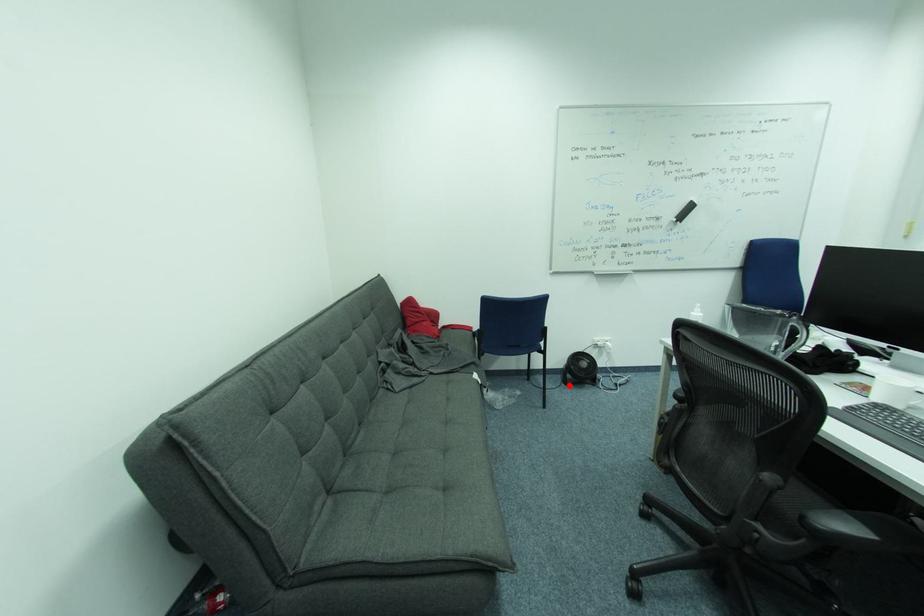
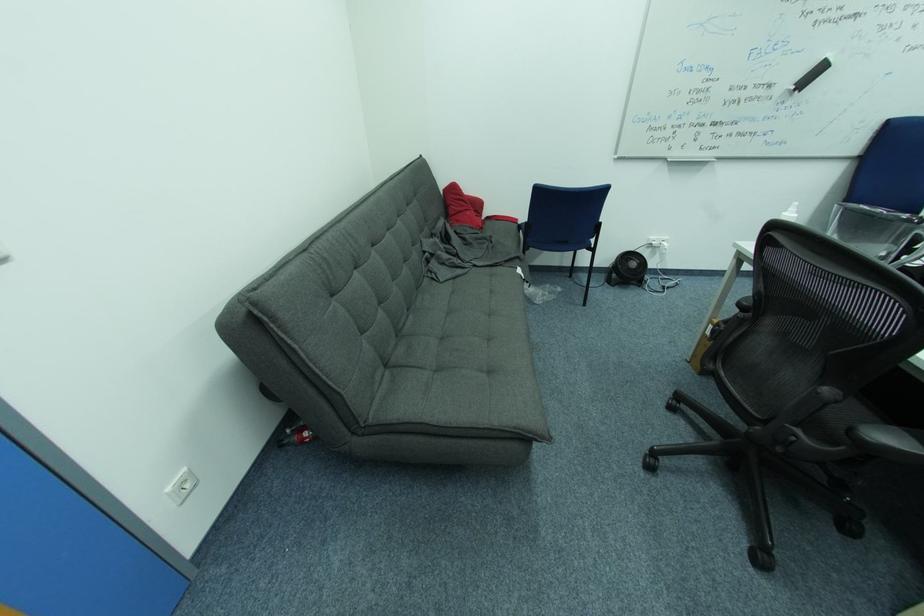
In the second image, find the point that corresponds to the highlighted location in the first image.

(613, 285)